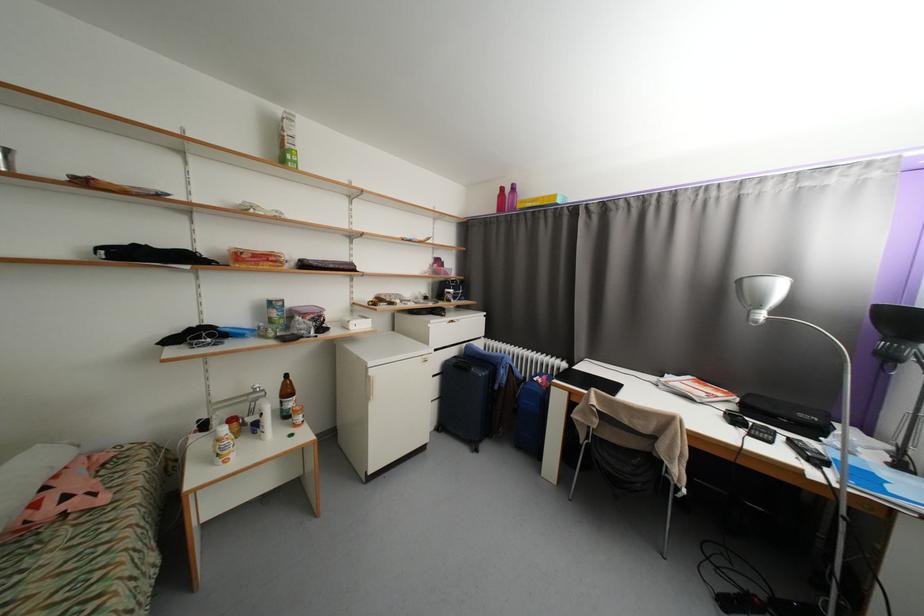
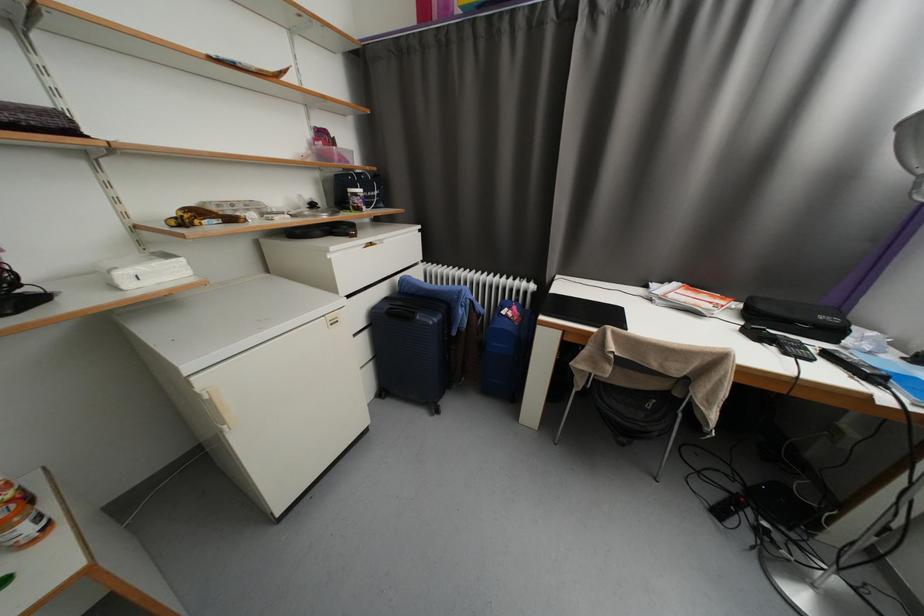
Based on the continuous images, in which direction is the camera rotating?

The camera's rotation is toward right-down.